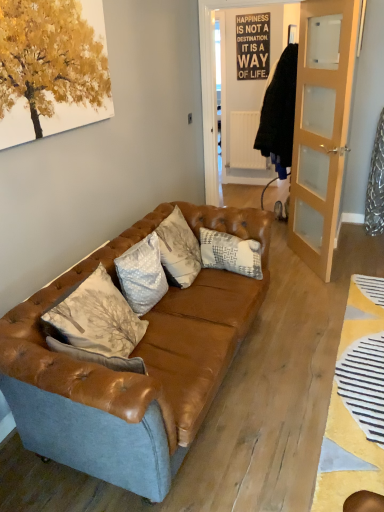
At what (x,y) coordinates should I click in order to perform the action: click on vacant region to the left of light brown wooden door at right. Please return your answer as a coordinate pair (x, y). Looking at the image, I should click on (283, 265).